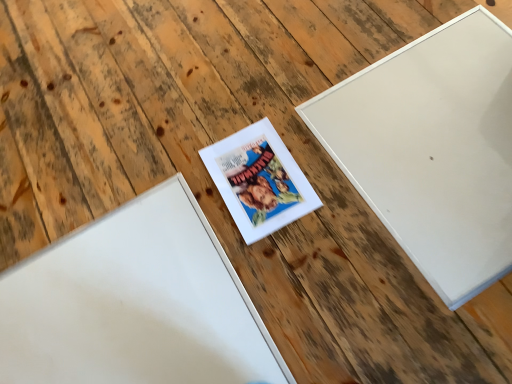
The image size is (512, 384). Identify the location of free spot below white matte picture frame at center, the 3th picture frame in the right-to-left sequence (from a real-world perspective). (127, 315).